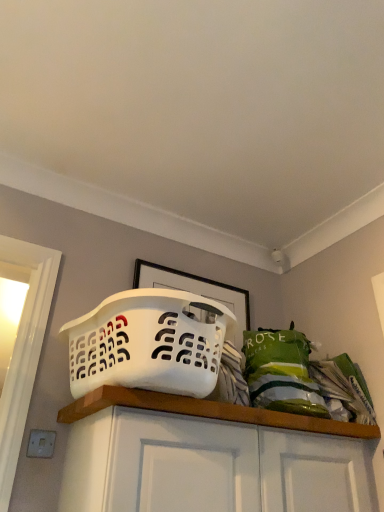
Question: Can you confirm if white matte cabinet at center is thinner than white plastic laundry basket at center?

Choices:
 (A) no
 (B) yes

Answer: (B)

Question: From the image's perspective, is white matte cabinet at center on white plastic laundry basket at center?

Choices:
 (A) no
 (B) yes

Answer: (A)

Question: Can you confirm if white matte cabinet at center is positioned to the left of white plastic laundry basket at center?

Choices:
 (A) no
 (B) yes

Answer: (A)

Question: Considering the relative sizes of white matte cabinet at center and white plastic laundry basket at center in the image provided, is white matte cabinet at center smaller than white plastic laundry basket at center?

Choices:
 (A) no
 (B) yes

Answer: (B)

Question: Is white matte cabinet at center outside white plastic laundry basket at center?

Choices:
 (A) no
 (B) yes

Answer: (B)

Question: Is white matte cabinet at center behind white plastic laundry basket at center?

Choices:
 (A) no
 (B) yes

Answer: (A)

Question: Is white matte cabinet at center completely or partially inside white plastic laundry basket at center?

Choices:
 (A) no
 (B) yes

Answer: (A)

Question: From a real-world perspective, is white plastic laundry basket at center positioned over white matte cabinet at center based on gravity?

Choices:
 (A) no
 (B) yes

Answer: (B)

Question: Can you confirm if white plastic laundry basket at center is positioned to the left of white matte cabinet at center?

Choices:
 (A) yes
 (B) no

Answer: (A)

Question: Is the depth of white plastic laundry basket at center less than that of white matte cabinet at center?

Choices:
 (A) yes
 (B) no

Answer: (B)

Question: Considering the relative positions of white plastic laundry basket at center and white matte cabinet at center in the image provided, is white plastic laundry basket at center to the right of white matte cabinet at center from the viewer's perspective?

Choices:
 (A) no
 (B) yes

Answer: (A)

Question: Considering the relative sizes of white plastic laundry basket at center and white matte cabinet at center in the image provided, is white plastic laundry basket at center shorter than white matte cabinet at center?

Choices:
 (A) no
 (B) yes

Answer: (B)

Question: Is white matte cabinet at center taller or shorter than white plastic laundry basket at center?

Choices:
 (A) short
 (B) tall

Answer: (B)